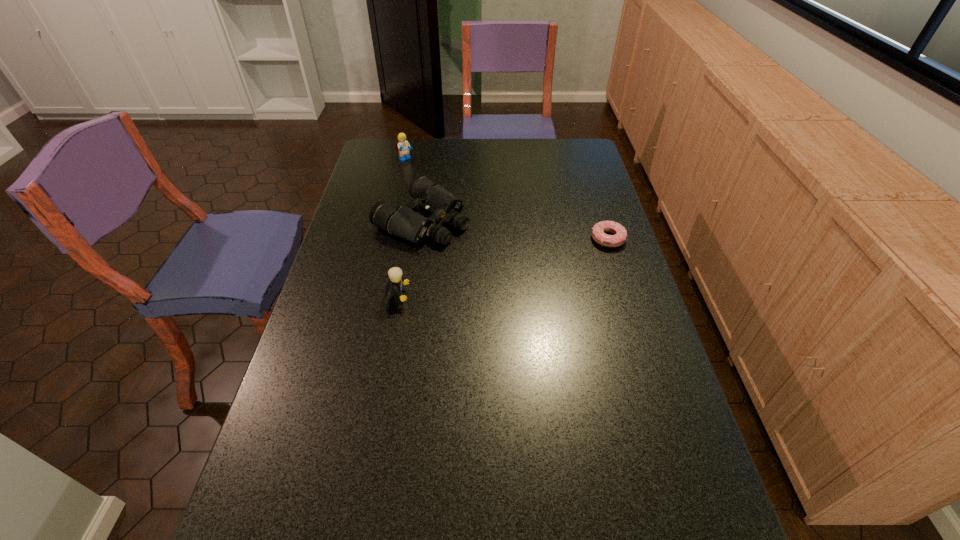
The height and width of the screenshot is (540, 960). What are the coordinates of `empty space between the nearest object and the binoculars` in the screenshot? It's located at (410, 258).

Identify the location of vacant area that lies between the shortest object and the right Lego. (503, 268).

What are the coordinates of `free space between the nearer Lego and the doughnut` in the screenshot? It's located at (503, 268).

Identify which object is the third nearest to the doughnut. Please provide its 2D coordinates. Your answer should be formatted as a tuple, i.e. [(x, y)], where the tuple contains the x and y coordinates of a point satisfying the conditions above.

[(402, 147)]

Locate an element on the screen. The width and height of the screenshot is (960, 540). object that is the second nearest to the farthest object is located at coordinates click(x=396, y=281).